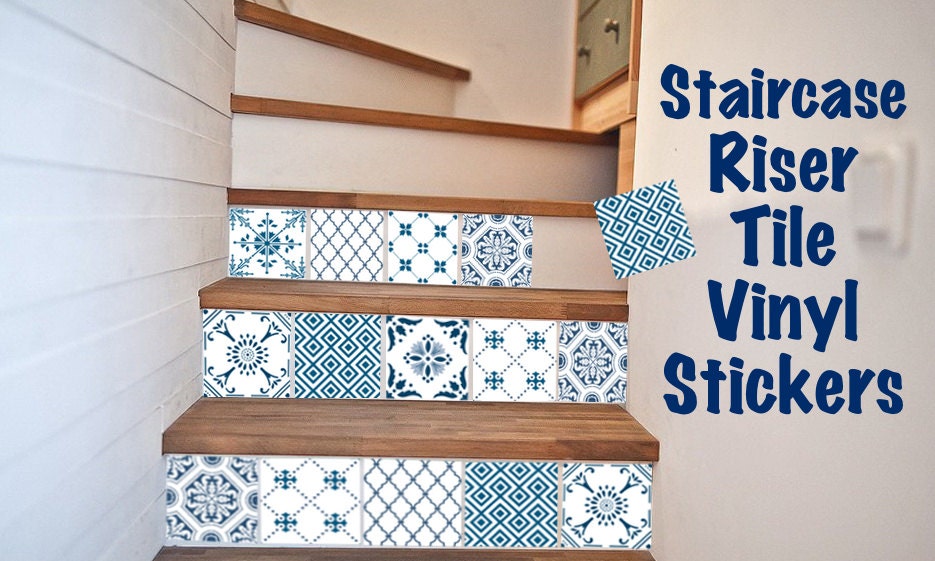
Locate an element on the screen. wall made with boards is located at coordinates (108, 149).